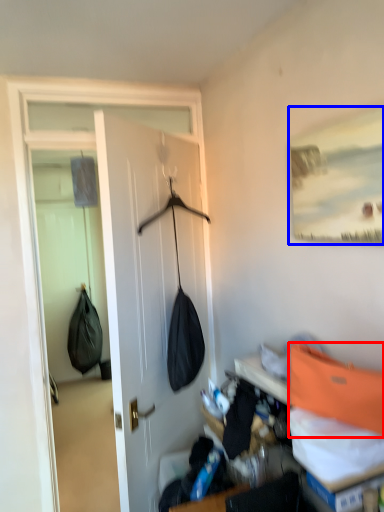
Question: Which of the following is the closest to the observer, shoulder bag (highlighted by a red box) or picture frame (highlighted by a blue box)?

Choices:
 (A) shoulder bag
 (B) picture frame

Answer: (A)